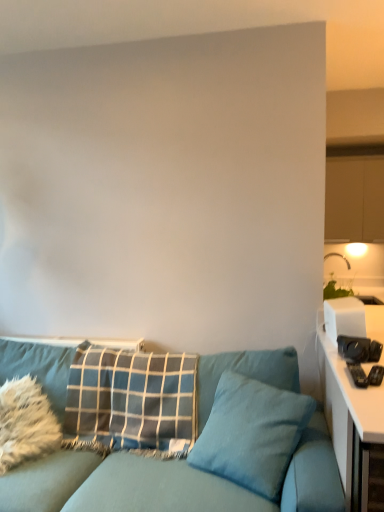
This screenshot has width=384, height=512. What do you see at coordinates (171, 483) in the screenshot?
I see `teal fabric couch at lower left` at bounding box center [171, 483].

What is the approximate width of white glossy table at right?

white glossy table at right is 31.15 inches wide.

Image resolution: width=384 pixels, height=512 pixels. Describe the element at coordinates (132, 397) in the screenshot. I see `blue plaid pillow at center, the 2th pillow from the left` at that location.

You are a GUI agent. You are given a task and a screenshot of the screen. Output one action in this format:
    pyautogui.click(x=<x>, y=<y>)
    Task: Click on the teal fabric pillow at center, which is the 3th pillow from left to right
    
    Given the screenshot: What is the action you would take?
    pyautogui.click(x=252, y=433)

What do you see at coordinates (252, 433) in the screenshot?
I see `teal fabric pillow at center, which is the 3th pillow from left to right` at bounding box center [252, 433].

This screenshot has height=512, width=384. Find the location of `teal fabric couch at lower left`. teal fabric couch at lower left is located at coordinates (171, 483).

Does teal fabric couch at lower left have a lesser width compared to teal fabric pillow at center, arranged as the 1th pillow when viewed from the right?

In fact, teal fabric couch at lower left might be wider than teal fabric pillow at center, arranged as the 1th pillow when viewed from the right.

Is teal fabric couch at lower left not close to teal fabric pillow at center, which is the 3th pillow from left to right?

No.

From the image's perspective, which pillow is the 2nd one above the teal fabric couch at lower left? Please provide its 2D coordinates.

[(252, 433)]

Measure the distance from teal fabric couch at lower left to teal fabric pillow at center, arranged as the 1th pillow when viewed from the right.

The distance of teal fabric couch at lower left from teal fabric pillow at center, arranged as the 1th pillow when viewed from the right, is 9.19 inches.

Does point (87, 371) come in front of point (243, 465)?

No, (87, 371) is further to viewer.

Considering their positions, is blue plaid pillow at center, the 2th pillow from the left, located in front of or behind teal fabric pillow at center, arranged as the 1th pillow when viewed from the right?

Visually, blue plaid pillow at center, the 2th pillow from the left, is located behind teal fabric pillow at center, arranged as the 1th pillow when viewed from the right.

From the image's perspective, relative to teal fabric pillow at center, arranged as the 1th pillow when viewed from the right, is blue plaid pillow at center, the second pillow when ordered from right to left, above or below?

Clearly, from the image's perspective, blue plaid pillow at center, the second pillow when ordered from right to left, is above teal fabric pillow at center, arranged as the 1th pillow when viewed from the right.

Locate an element on the screen. This screenshot has width=384, height=512. pillow lying above the teal fabric pillow at center, which is the 3th pillow from left to right (from the image's perspective) is located at coordinates (132, 397).

Which is behind, point (63, 351) or point (358, 307)?

The point (63, 351) is behind.

How different are the orientations of white fluffy pillow at lower left, acting as the 1th pillow starting from the left, and white plastic toaster at right in degrees?

20.5 degrees separate the facing orientations of white fluffy pillow at lower left, acting as the 1th pillow starting from the left, and white plastic toaster at right.

Could you measure the distance between white fluffy pillow at lower left, acting as the 1th pillow starting from the left, and white plastic toaster at right?

white fluffy pillow at lower left, acting as the 1th pillow starting from the left, and white plastic toaster at right are 4.95 feet apart.

Is white fluffy pillow at lower left, marked as the third pillow in a right-to-left arrangement, situated inside white plastic toaster at right or outside?

white fluffy pillow at lower left, marked as the third pillow in a right-to-left arrangement, is not inside white plastic toaster at right, it's outside.

Consider the image. Does white plastic toaster at right come in front of teal fabric pillow at center, which is the 3th pillow from left to right?

No, the depth of white plastic toaster at right is greater than that of teal fabric pillow at center, which is the 3th pillow from left to right.

Considering the positions of point (332, 302) and point (266, 495), is point (332, 302) closer or farther from the camera than point (266, 495)?

Point (332, 302) appears to be farther away from the viewer than point (266, 495).

Based on the photo, how many degrees apart are the facing directions of white plastic toaster at right and teal fabric pillow at center, arranged as the 1th pillow when viewed from the right?

The angle between the facing direction of white plastic toaster at right and the facing direction of teal fabric pillow at center, arranged as the 1th pillow when viewed from the right, is 120 degrees.

Which object is wider, teal fabric pillow at center, arranged as the 1th pillow when viewed from the right, or white fluffy pillow at lower left, marked as the third pillow in a right-to-left arrangement?

Wider between the two is teal fabric pillow at center, arranged as the 1th pillow when viewed from the right.

Can you confirm if teal fabric pillow at center, arranged as the 1th pillow when viewed from the right, is bigger than white fluffy pillow at lower left, acting as the 1th pillow starting from the left?

Yes, teal fabric pillow at center, arranged as the 1th pillow when viewed from the right, is bigger than white fluffy pillow at lower left, acting as the 1th pillow starting from the left.

Relative to white fluffy pillow at lower left, acting as the 1th pillow starting from the left, is teal fabric pillow at center, arranged as the 1th pillow when viewed from the right, in front or behind?

Visually, teal fabric pillow at center, arranged as the 1th pillow when viewed from the right, is located in front of white fluffy pillow at lower left, acting as the 1th pillow starting from the left.

In the scene shown: From a real-world perspective, is teal fabric pillow at center, arranged as the 1th pillow when viewed from the right, over white fluffy pillow at lower left, acting as the 1th pillow starting from the left?

Indeed, from a real-world perspective, teal fabric pillow at center, arranged as the 1th pillow when viewed from the right, stands above white fluffy pillow at lower left, acting as the 1th pillow starting from the left.

Between white glossy table at right and blue plaid pillow at center, the second pillow when ordered from right to left, which one appears on the right side from the viewer's perspective?

Positioned to the right is white glossy table at right.

What's the angular difference between white glossy table at right and blue plaid pillow at center, the 2th pillow from the left,'s facing directions?

90.3 degrees.

Considering the positions of objects white glossy table at right and blue plaid pillow at center, the second pillow when ordered from right to left, in the image provided, who is in front, white glossy table at right or blue plaid pillow at center, the second pillow when ordered from right to left,?

white glossy table at right is more forward.

From the image's perspective, is white glossy table at right located above or below blue plaid pillow at center, the second pillow when ordered from right to left?

Based on their image positions, white glossy table at right is located beneath blue plaid pillow at center, the second pillow when ordered from right to left.

Considering the relative sizes of teal fabric pillow at center, arranged as the 1th pillow when viewed from the right, and teal fabric couch at lower left in the image provided, is teal fabric pillow at center, arranged as the 1th pillow when viewed from the right, wider than teal fabric couch at lower left?

In fact, teal fabric pillow at center, arranged as the 1th pillow when viewed from the right, might be narrower than teal fabric couch at lower left.

From the image's perspective, is teal fabric pillow at center, arranged as the 1th pillow when viewed from the right, under teal fabric couch at lower left?

No.

Where is `studio couch below the teal fabric pillow at center, which is the 3th pillow from left to right (from the image's perspective)`? studio couch below the teal fabric pillow at center, which is the 3th pillow from left to right (from the image's perspective) is located at coordinates (171, 483).

Considering the sizes of objects teal fabric pillow at center, arranged as the 1th pillow when viewed from the right, and teal fabric couch at lower left in the image provided, who is bigger, teal fabric pillow at center, arranged as the 1th pillow when viewed from the right, or teal fabric couch at lower left?

Bigger between the two is teal fabric couch at lower left.

I want to click on studio couch on the left of teal fabric pillow at center, arranged as the 1th pillow when viewed from the right, so click(171, 483).

There is a blue plaid pillow at center, the 2th pillow from the left. Where is `the 1st pillow below it (from the image's perspective)`? The image size is (384, 512). the 1st pillow below it (from the image's perspective) is located at coordinates (252, 433).

Considering their positions, is white glossy table at right positioned further to teal fabric pillow at center, arranged as the 1th pillow when viewed from the right, than teal fabric couch at lower left?

white glossy table at right is further to teal fabric pillow at center, arranged as the 1th pillow when viewed from the right.

When comparing their distances from white glossy table at right, does teal fabric couch at lower left or blue plaid pillow at center, the 2th pillow from the left, seem further?

blue plaid pillow at center, the 2th pillow from the left.

Estimate the real-world distances between objects in this image. Which object is closer to white fluffy pillow at lower left, acting as the 1th pillow starting from the left, teal fabric pillow at center, arranged as the 1th pillow when viewed from the right, or white plastic toaster at right?

The object closer to white fluffy pillow at lower left, acting as the 1th pillow starting from the left, is teal fabric pillow at center, arranged as the 1th pillow when viewed from the right.

Based on their spatial positions, is white plastic toaster at right or blue plaid pillow at center, the second pillow when ordered from right to left, closer to white glossy table at right?

white plastic toaster at right is positioned closer to the anchor white glossy table at right.

Based on their spatial positions, is blue plaid pillow at center, the second pillow when ordered from right to left, or teal fabric pillow at center, arranged as the 1th pillow when viewed from the right, further from teal fabric couch at lower left?

blue plaid pillow at center, the second pillow when ordered from right to left, is positioned further to the anchor teal fabric couch at lower left.

Based on their spatial positions, is blue plaid pillow at center, the 2th pillow from the left, or white glossy table at right further from teal fabric pillow at center, which is the 3th pillow from left to right?

blue plaid pillow at center, the 2th pillow from the left, lies further to teal fabric pillow at center, which is the 3th pillow from left to right, than the other object.

Which object lies nearer to the anchor point white fluffy pillow at lower left, marked as the third pillow in a right-to-left arrangement, white plastic toaster at right or teal fabric couch at lower left?

teal fabric couch at lower left.

Looking at the image, which one is located closer to teal fabric couch at lower left, white fluffy pillow at lower left, marked as the third pillow in a right-to-left arrangement, or white glossy table at right?

The object closer to teal fabric couch at lower left is white fluffy pillow at lower left, marked as the third pillow in a right-to-left arrangement.

Find the location of a particular element. appliance between teal fabric couch at lower left and white glossy table at right is located at coordinates (344, 318).

Where is `studio couch between white fluffy pillow at lower left, marked as the third pillow in a right-to-left arrangement, and white plastic toaster at right`? This screenshot has width=384, height=512. studio couch between white fluffy pillow at lower left, marked as the third pillow in a right-to-left arrangement, and white plastic toaster at right is located at coordinates (171, 483).

This screenshot has width=384, height=512. What are the coordinates of `pillow between white fluffy pillow at lower left, marked as the third pillow in a right-to-left arrangement, and teal fabric pillow at center, which is the 3th pillow from left to right` in the screenshot? It's located at (132, 397).

Identify the location of appliance between white fluffy pillow at lower left, marked as the third pillow in a right-to-left arrangement, and white glossy table at right, in the horizontal direction. (344, 318).